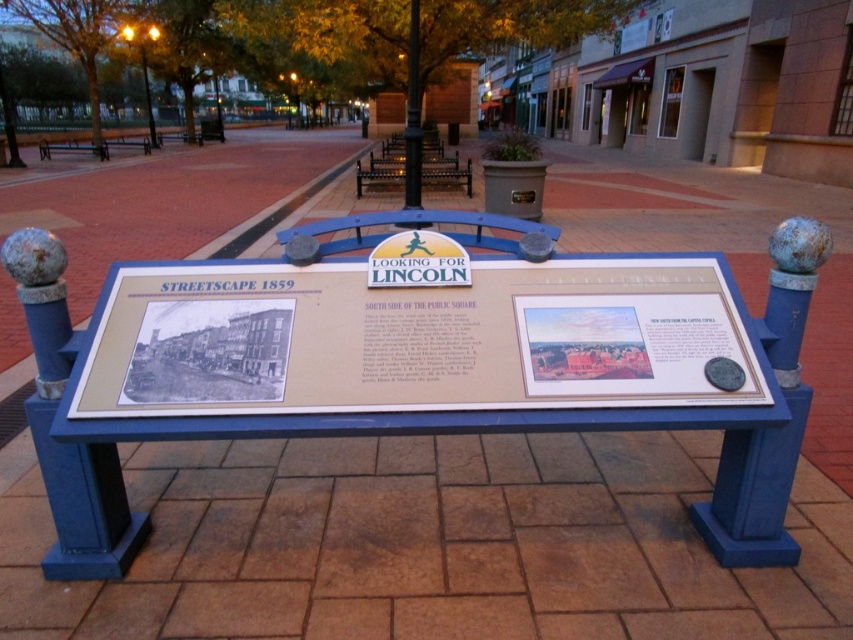
You are a visitor in the plaza and want to sit on the blue painted wood bench at left. However, you notice another bench, the blue painted wood bench at upper left. Which bench is taller?

The blue painted wood bench at upper left is taller than the blue painted wood bench at left.

You are standing at the point marked as point (444,166) in the image. What object is exactly at that point?

The metallic dark brown bench at center is located at point (444,166).

You are standing in the plaza and want to determine which of the two points, point (469,172) or point (109,140), is nearer to you. Based on the image, which point is closer?

Point (469,172) is closer to the viewer than point (109,140).